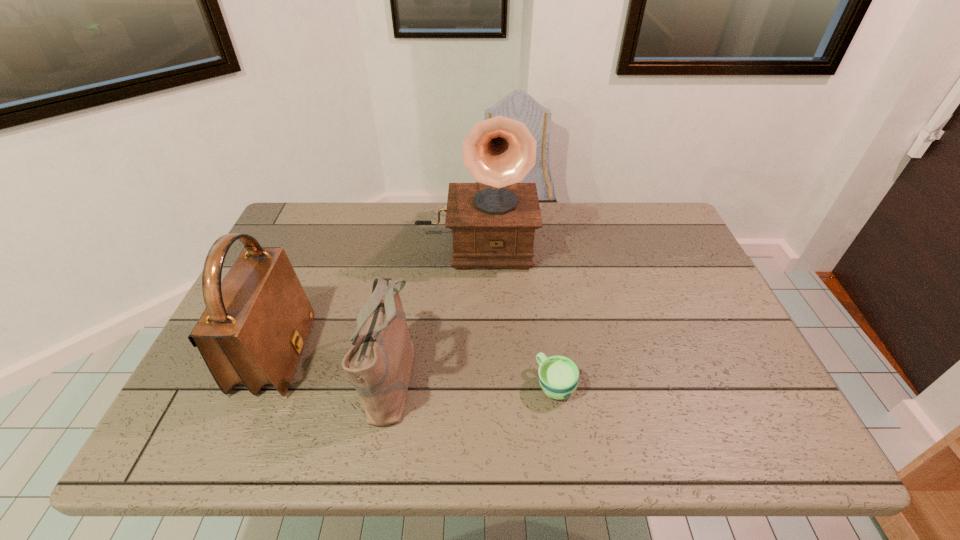
Image resolution: width=960 pixels, height=540 pixels. What are the coordinates of `object positioned at the near edge` in the screenshot? It's located at (379, 363).

You are a GUI agent. You are given a task and a screenshot of the screen. Output one action in this format:
    pyautogui.click(x=<x>, y=<y>)
    Task: Click on the object at the left edge
    Image resolution: width=960 pixels, height=540 pixels.
    Given the screenshot: What is the action you would take?
    pyautogui.click(x=254, y=327)

Where is `vacant space at the far edge`? The height and width of the screenshot is (540, 960). vacant space at the far edge is located at coordinates (596, 204).

The width and height of the screenshot is (960, 540). Find the location of `free region at the near edge`. free region at the near edge is located at coordinates (683, 414).

In the image, there is a desktop. At what (x,y) coordinates should I click in order to perform the action: click on vacant space at the right edge. Please return your answer as a coordinate pair (x, y). The height and width of the screenshot is (540, 960). Looking at the image, I should click on (680, 326).

Where is `free spot at the far left corner of the desktop`? This screenshot has height=540, width=960. free spot at the far left corner of the desktop is located at coordinates (324, 246).

Find the location of a particular element. free space between the tallest object and the right shoulder bag is located at coordinates (433, 309).

Identify the location of empty location between the right shoulder bag and the tallest object. The image size is (960, 540). (433, 309).

Find the location of a particular element. free spot between the record player and the cup is located at coordinates [x=516, y=313].

Locate an element on the screen. The height and width of the screenshot is (540, 960). free point between the left shoulder bag and the right shoulder bag is located at coordinates (334, 365).